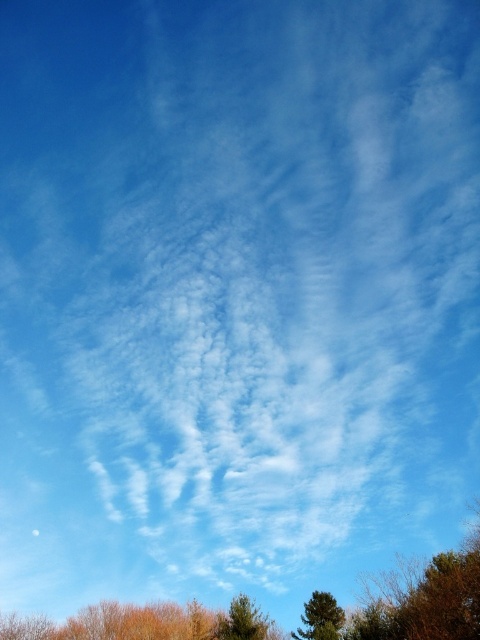
You are an environmental scientist analyzing the image. You need to determine which tree has a greater canopy spread. Which tree has a larger size between the brown leafy tree at lower right and the green textured tree at lower center?

The brown leafy tree at lower right has a larger size compared to the green textured tree at lower center, so it has a greater canopy spread.

You are a bird flying in the serene sky scene. You want to land on a tree at the bottom of the image. Which tree, the brown textured tree at lower center or the green matte tree at lower center, is positioned higher for you to land on first?

The brown textured tree at lower center is located above the green matte tree at lower center, so you should land on the brown textured tree at lower center first.